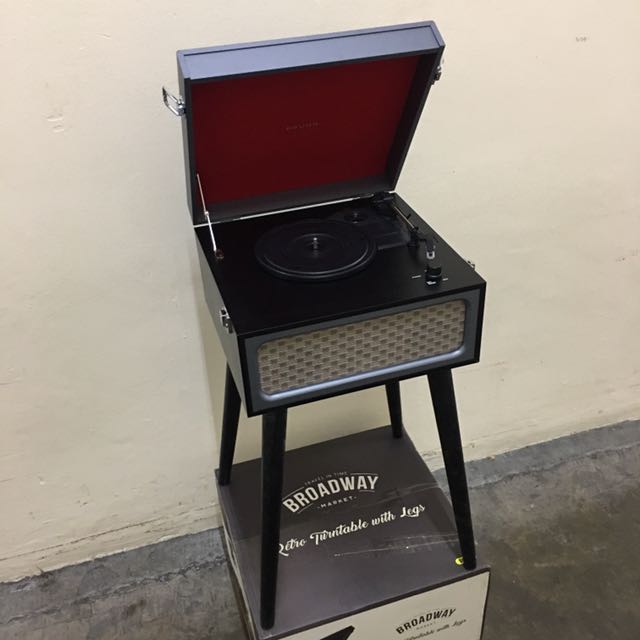
The image size is (640, 640). I want to click on floor, so click(x=554, y=548).